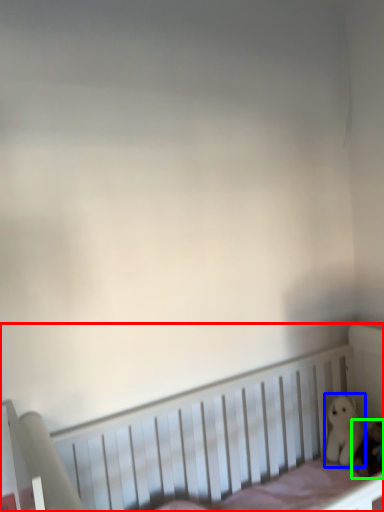
Question: Which object is positioned closest to infant bed (highlighted by a red box)? Select from toy (highlighted by a blue box) and toy (highlighted by a green box).

Choices:
 (A) toy
 (B) toy

Answer: (A)